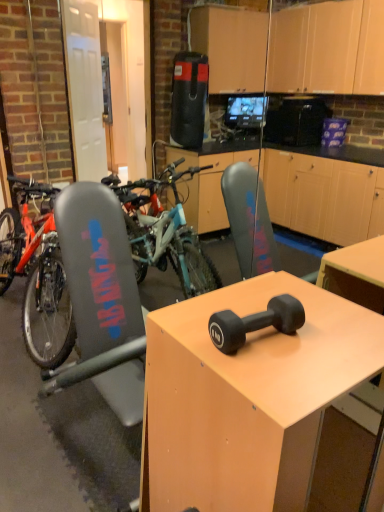
The width and height of the screenshot is (384, 512). In order to click on free space to the back side of black rubber dumbbell at center in this screenshot , I will do `click(238, 298)`.